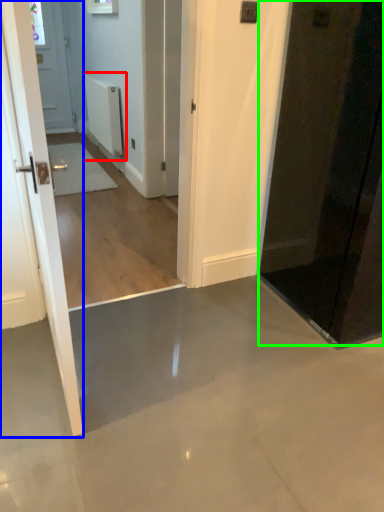
Question: Considering the real-world distances, which object is farthest from radiator (highlighted by a red box)? door (highlighted by a blue box) or door (highlighted by a green box)?

Choices:
 (A) door
 (B) door

Answer: (A)